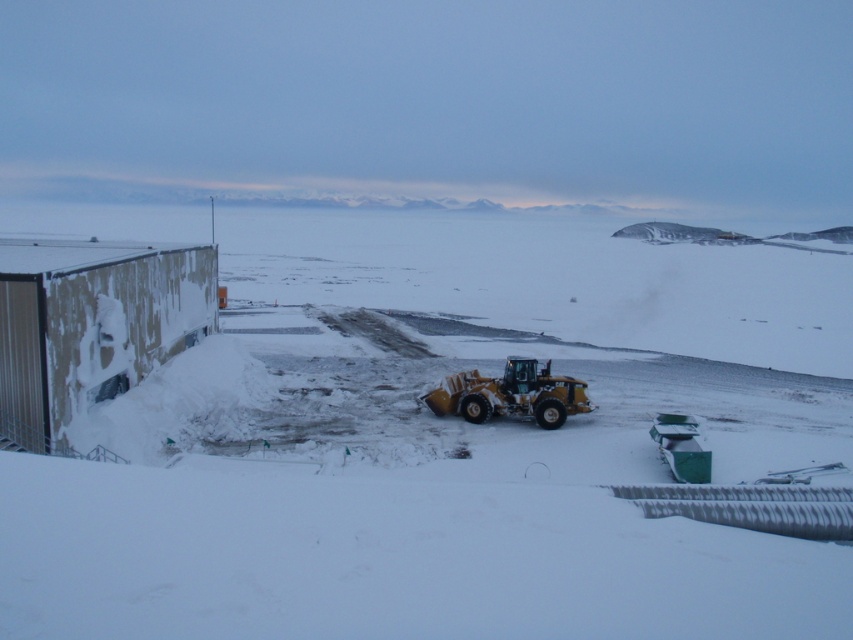
Does white powdery snow at center have a greater height compared to yellow rubber plow at center?

Correct, white powdery snow at center is much taller as yellow rubber plow at center.

Is white powdery snow at center to the left of yellow rubber plow at center from the viewer's perspective?

Indeed, white powdery snow at center is positioned on the left side of yellow rubber plow at center.

Is point (791, 616) closer to camera compared to point (527, 401)?

Yes, it is.

Identify the location of white powdery snow at center. (444, 444).